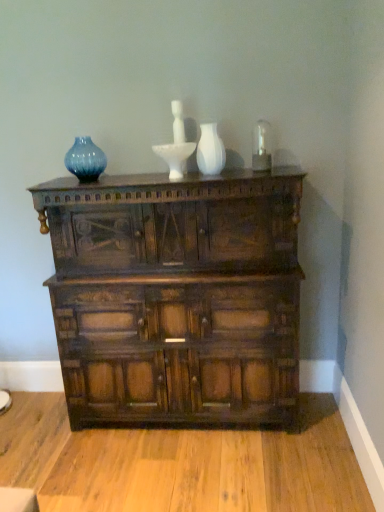
Question: Is dark wood chest of drawers at center located outside blue glass vase at upper left?

Choices:
 (A) yes
 (B) no

Answer: (A)

Question: Is dark wood chest of drawers at center oriented away from blue glass vase at upper left?

Choices:
 (A) no
 (B) yes

Answer: (A)

Question: From a real-world perspective, is dark wood chest of drawers at center beneath blue glass vase at upper left?

Choices:
 (A) no
 (B) yes

Answer: (B)

Question: Does dark wood chest of drawers at center have a lesser height compared to blue glass vase at upper left?

Choices:
 (A) no
 (B) yes

Answer: (A)

Question: Can you confirm if dark wood chest of drawers at center is wider than blue glass vase at upper left?

Choices:
 (A) yes
 (B) no

Answer: (A)

Question: Is dark wood chest of drawers at center positioned far away from blue glass vase at upper left?

Choices:
 (A) yes
 (B) no

Answer: (B)

Question: From the image's perspective, is white glossy vase at center under dark wood chest of drawers at center?

Choices:
 (A) yes
 (B) no

Answer: (B)

Question: Considering the relative positions of white glossy vase at center and dark wood chest of drawers at center in the image provided, is white glossy vase at center to the left of dark wood chest of drawers at center from the viewer's perspective?

Choices:
 (A) yes
 (B) no

Answer: (B)

Question: Can you confirm if white glossy vase at center is wider than dark wood chest of drawers at center?

Choices:
 (A) no
 (B) yes

Answer: (A)

Question: Can you confirm if white glossy vase at center is smaller than dark wood chest of drawers at center?

Choices:
 (A) yes
 (B) no

Answer: (A)

Question: From the image's perspective, is white glossy vase at center on dark wood chest of drawers at center?

Choices:
 (A) yes
 (B) no

Answer: (A)

Question: Would you say white glossy vase at center contains dark wood chest of drawers at center?

Choices:
 (A) no
 (B) yes

Answer: (A)

Question: Is white glossy vase at center looking in the opposite direction of blue glass vase at upper left?

Choices:
 (A) yes
 (B) no

Answer: (B)